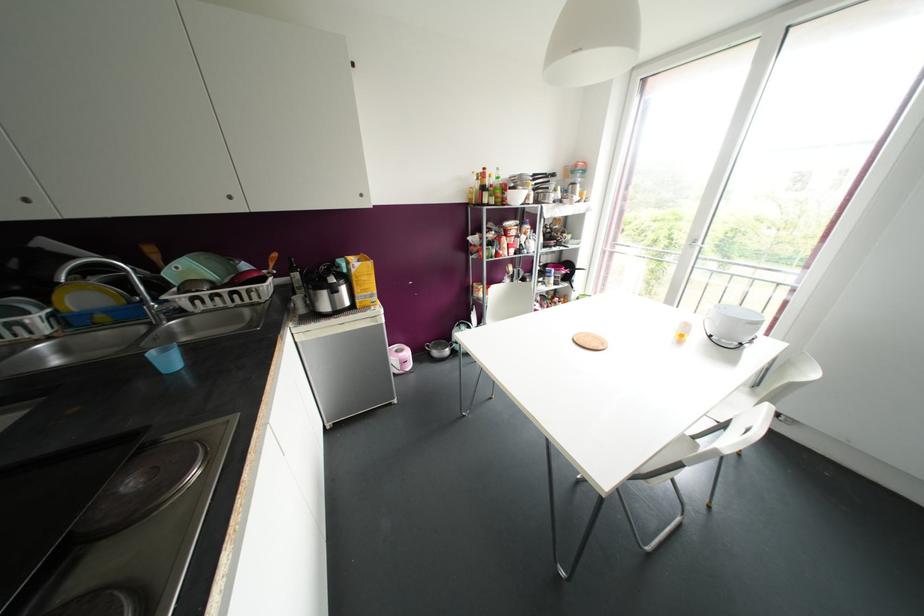
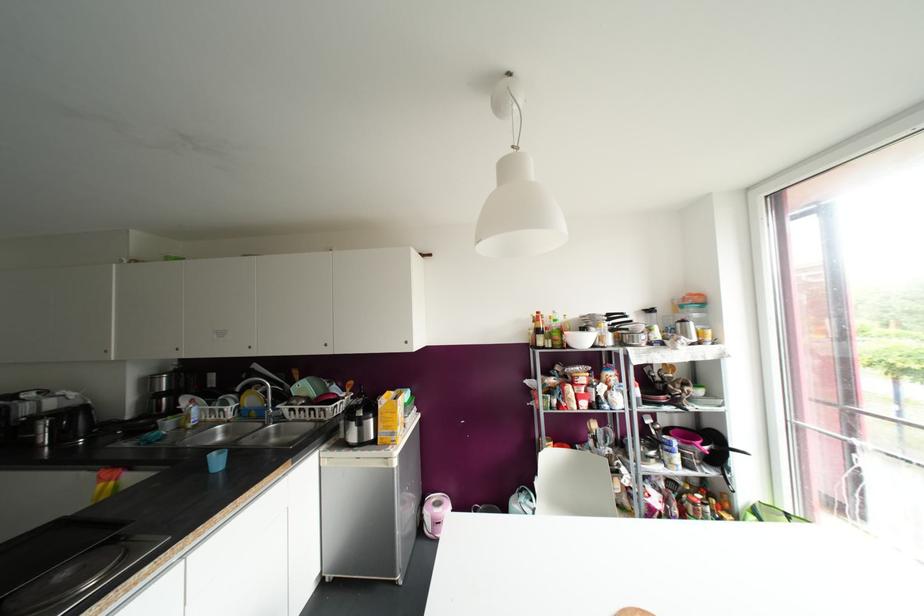
The images are taken continuously from a first-person perspective. In which direction is your viewpoint rotating?

The camera's rotation is toward left-up.